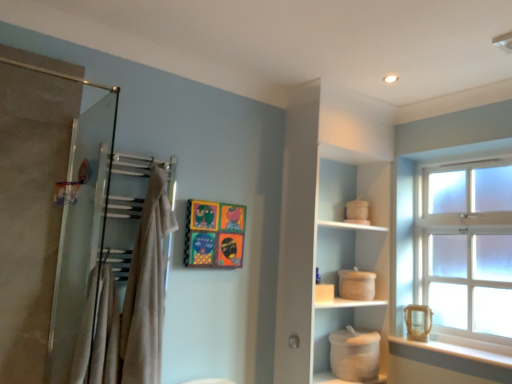
Question: Is beige cotton bath towel at upper left, marked as the first bath towel in a right-to-left arrangement, to the left or to the right of white matte cabinet at center in the image?

Choices:
 (A) left
 (B) right

Answer: (A)

Question: Considering the positions of beige cotton bath towel at upper left, marked as the first bath towel in a right-to-left arrangement, and white matte cabinet at center in the image, is beige cotton bath towel at upper left, marked as the first bath towel in a right-to-left arrangement, taller or shorter than white matte cabinet at center?

Choices:
 (A) short
 (B) tall

Answer: (A)

Question: Which is farther from the white smooth window sill at lower right?

Choices:
 (A) beige cotton bath towel at upper left, which is the second bath towel in left-to-right order
 (B) white matte pot at lower center
 (C) beige cotton bath towel at left, which appears as the first bath towel when viewed from the left
 (D) wooden painted picture frame at upper center
 (E) clear glass window at upper right

Answer: (C)

Question: Estimate the real-world distances between objects in this image. Which object is closer to the white matte cabinet at center?

Choices:
 (A) beige cotton bath towel at left, acting as the second bath towel starting from the right
 (B) wooden painted picture frame at upper center
 (C) white matte pot at lower center
 (D) beige cotton bath towel at upper left, marked as the first bath towel in a right-to-left arrangement
 (E) white smooth window sill at lower right

Answer: (C)